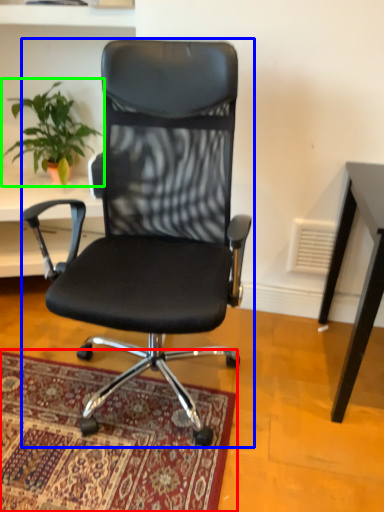
Question: Which object is the closest to the mat (highlighted by a red box)? Choose among these: chair (highlighted by a blue box) or houseplant (highlighted by a green box).

Choices:
 (A) chair
 (B) houseplant

Answer: (A)